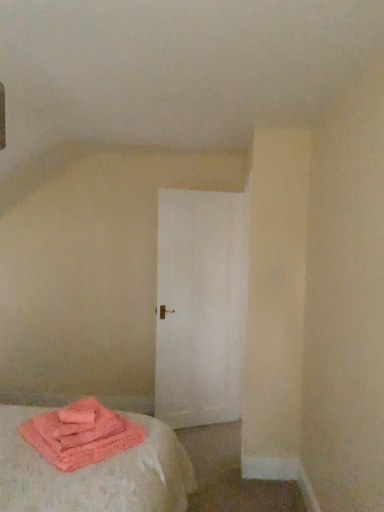
Where is `white matte door at center`? The height and width of the screenshot is (512, 384). white matte door at center is located at coordinates (200, 306).

Image resolution: width=384 pixels, height=512 pixels. What do you see at coordinates (200, 306) in the screenshot? I see `white matte door at center` at bounding box center [200, 306].

This screenshot has width=384, height=512. Describe the element at coordinates (80, 435) in the screenshot. I see `pink fluffy towels at lower left` at that location.

This screenshot has height=512, width=384. Identify the location of pink fluffy towels at lower left. (80, 435).

Image resolution: width=384 pixels, height=512 pixels. Find the location of `white matte door at center`. white matte door at center is located at coordinates (200, 306).

Between white matte door at center and pink fluffy towels at lower left, which one appears on the right side from the viewer's perspective?

white matte door at center is more to the right.

Considering the positions of objects white matte door at center and pink fluffy towels at lower left in the image provided, who is behind, white matte door at center or pink fluffy towels at lower left?

white matte door at center is further from the camera.

Is point (193, 294) farther from camera compared to point (94, 401)?

Yes, it is.

From the image's perspective, would you say white matte door at center is positioned over pink fluffy towels at lower left?

Yes, from the image's perspective, white matte door at center is above pink fluffy towels at lower left.

From a real-world perspective, who is located higher, white matte door at center or pink fluffy towels at lower left?

white matte door at center is physically above.

Which object is thinner, white matte door at center or pink fluffy towels at lower left?

white matte door at center.

Considering the sizes of objects white matte door at center and pink fluffy towels at lower left in the image provided, who is taller, white matte door at center or pink fluffy towels at lower left?

white matte door at center is taller.

Is white matte door at center smaller than pink fluffy towels at lower left?

No, white matte door at center is not smaller than pink fluffy towels at lower left.

Is white matte door at center spatially inside pink fluffy towels at lower left, or outside of it?

white matte door at center is not inside pink fluffy towels at lower left, it's outside.

Are white matte door at center and pink fluffy towels at lower left located far from each other?

white matte door at center is far away from pink fluffy towels at lower left.

Based on the photo, is white matte door at center facing towards pink fluffy towels at lower left?

No, white matte door at center is not oriented towards pink fluffy towels at lower left.

Measure the distance from white matte door at center to pink fluffy towels at lower left.

A distance of 5.49 feet exists between white matte door at center and pink fluffy towels at lower left.

There is a pink fluffy towels at lower left. Identify the location of door above it (from a real-world perspective). (200, 306).

Is pink fluffy towels at lower left at the right side of white matte door at center?

No.

Looking at this image, considering the positions of objects pink fluffy towels at lower left and white matte door at center in the image provided, who is behind, pink fluffy towels at lower left or white matte door at center?

Positioned behind is white matte door at center.

Which is nearer, (76, 423) or (241, 260)?

The point (76, 423) is in front.

From the image's perspective, is pink fluffy towels at lower left beneath white matte door at center?

Yes.

From a real-world perspective, which object stands above the other?

From a 3D spatial view, white matte door at center is above.

Is pink fluffy towels at lower left thinner than white matte door at center?

In fact, pink fluffy towels at lower left might be wider than white matte door at center.

Between pink fluffy towels at lower left and white matte door at center, which one has more height?

With more height is white matte door at center.

Between pink fluffy towels at lower left and white matte door at center, which one has smaller size?

pink fluffy towels at lower left is smaller.

Is pink fluffy towels at lower left completely or partially outside of white matte door at center?

That's correct, pink fluffy towels at lower left is outside of white matte door at center.

Based on the photo, is pink fluffy towels at lower left directly adjacent to white matte door at center?

Result: pink fluffy towels at lower left is not next to white matte door at center, and they're not touching.

Is pink fluffy towels at lower left turned away from white matte door at center?

Yes, pink fluffy towels at lower left is facing away from white matte door at center.

How many degrees apart are the facing directions of pink fluffy towels at lower left and white matte door at center?

68.6 degrees.

Locate an element on the screen. door lying above the pink fluffy towels at lower left (from the image's perspective) is located at coordinates (200, 306).

Identify the location of door on the right of pink fluffy towels at lower left. (200, 306).

The width and height of the screenshot is (384, 512). In the image, there is a white matte door at center. Find the location of `material below it (from the image's perspective)`. material below it (from the image's perspective) is located at coordinates (80, 435).